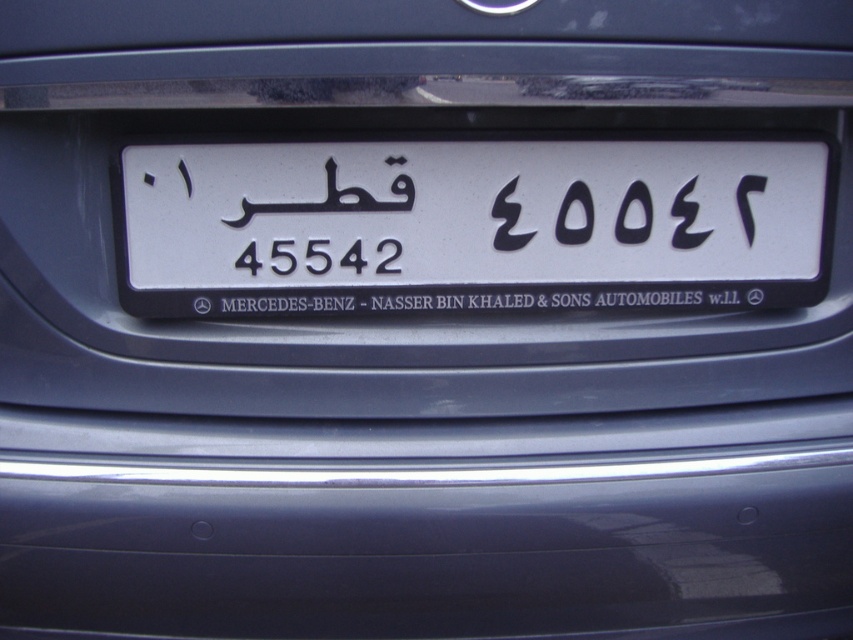
Question: Can you confirm if white plastic license plate at center is positioned to the left of black matte number at center?

Choices:
 (A) no
 (B) yes

Answer: (B)

Question: Is black plastic text at center wider than black matte number at center?

Choices:
 (A) no
 (B) yes

Answer: (B)

Question: Does black plastic text at center have a greater width compared to black matte number at center?

Choices:
 (A) yes
 (B) no

Answer: (A)

Question: Which of the following is the farthest from the observer?

Choices:
 (A) (358, 212)
 (B) (463, 294)

Answer: (B)

Question: Which point is closer to the camera?

Choices:
 (A) (422, 198)
 (B) (511, 236)
 (C) (405, 301)

Answer: (A)

Question: Among these objects, which one is farthest from the camera?

Choices:
 (A) black plastic text at center
 (B) black matte number at upper right
 (C) black matte number at center

Answer: (B)